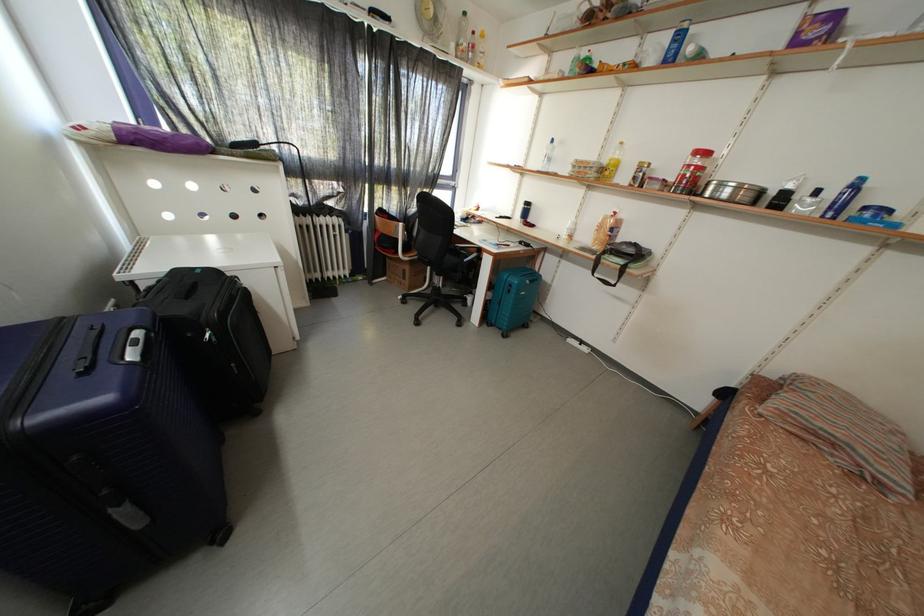
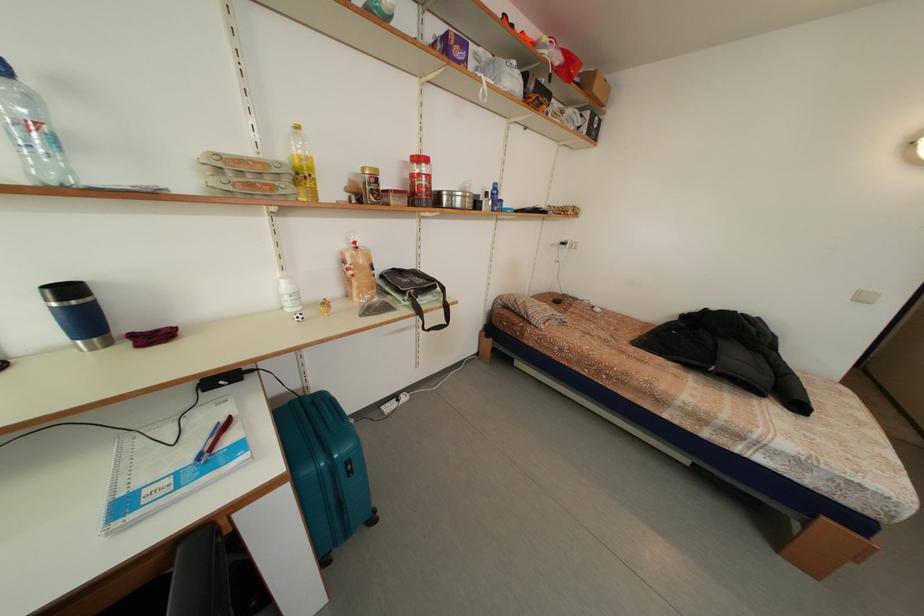
Locate, in the second image, the point that corresponds to pixel 562 155 in the first image.

(40, 106)